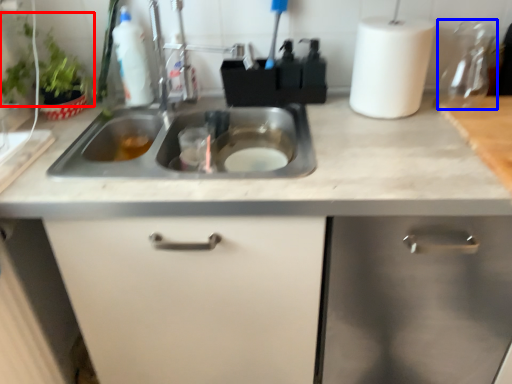
Question: Which of the following is the farthest to the observer, plant (highlighted by a red box) or appliance (highlighted by a blue box)?

Choices:
 (A) plant
 (B) appliance

Answer: (B)